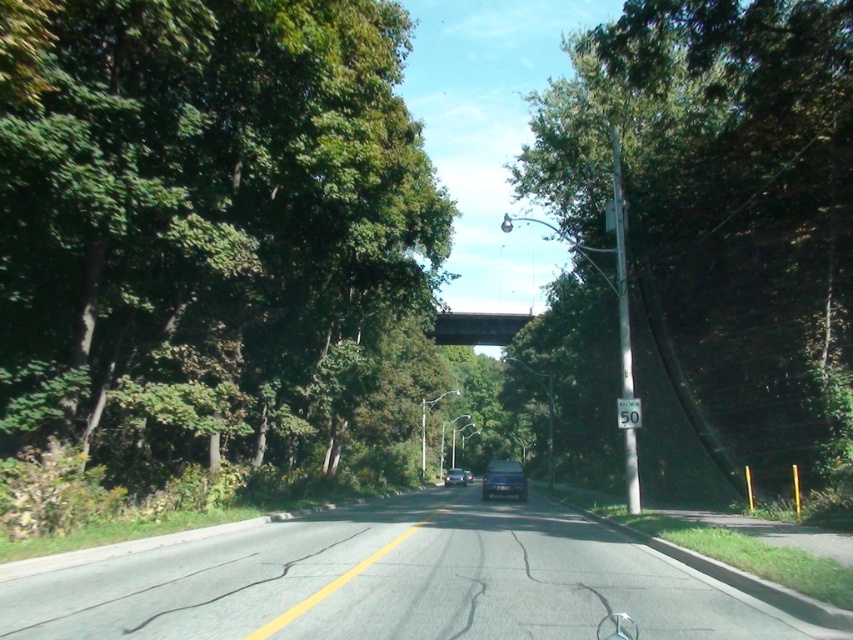
You are driving a car that is 15 feet long. You want to park your car behind the green metallic pole at right so that the entire car is hidden from view. Is this possible?

The green metallic pole at right is 59.48 feet from viewer. Since the car is 15 feet long, parking it behind the pole would require at least 15 feet of space behind the pole. However, the description only provides the distance of the pole from the viewer, not the available space behind it. Therefore, it is impossible to determine if the entire car can be hidden without additional information about the area behind the pole.

You are a driver approaching the road with a speed limit sign on the right. There is a point marked at coordinates [621,269]. What object is located at that point?

The point at coordinates [621,269] indicates a green metallic pole at right.

You are a driver approaching the green metallic pole at right and the concrete bridge at center. Which object will appear larger in your view as you drive closer?

The green metallic pole at right will appear larger in your view as you drive closer because it is much taller than the concrete bridge at center.